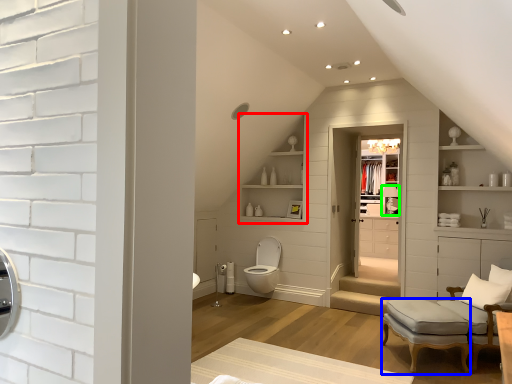
Question: Which is farther away from shelf (highlighted by a red box)? stool (highlighted by a blue box) or lamp (highlighted by a green box)?

Choices:
 (A) stool
 (B) lamp

Answer: (A)